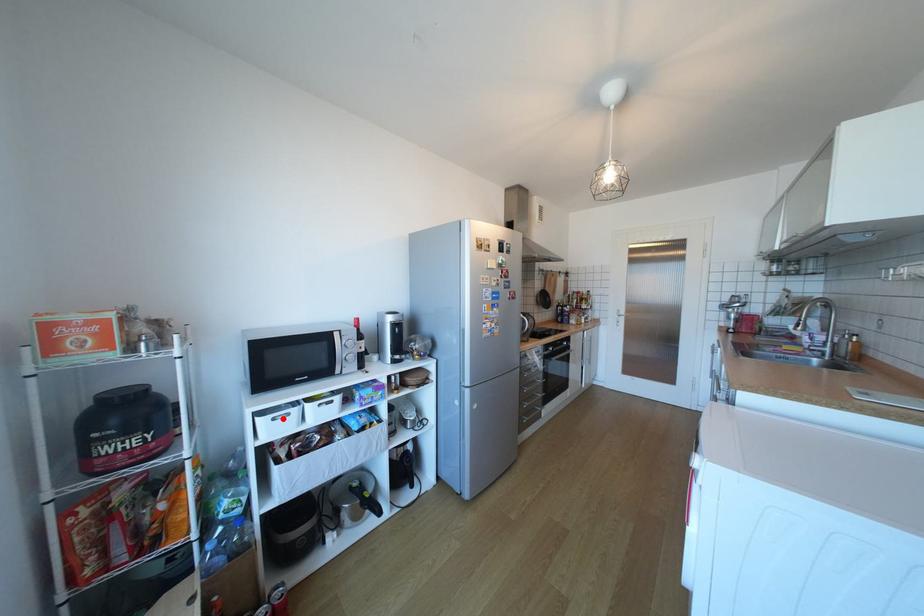
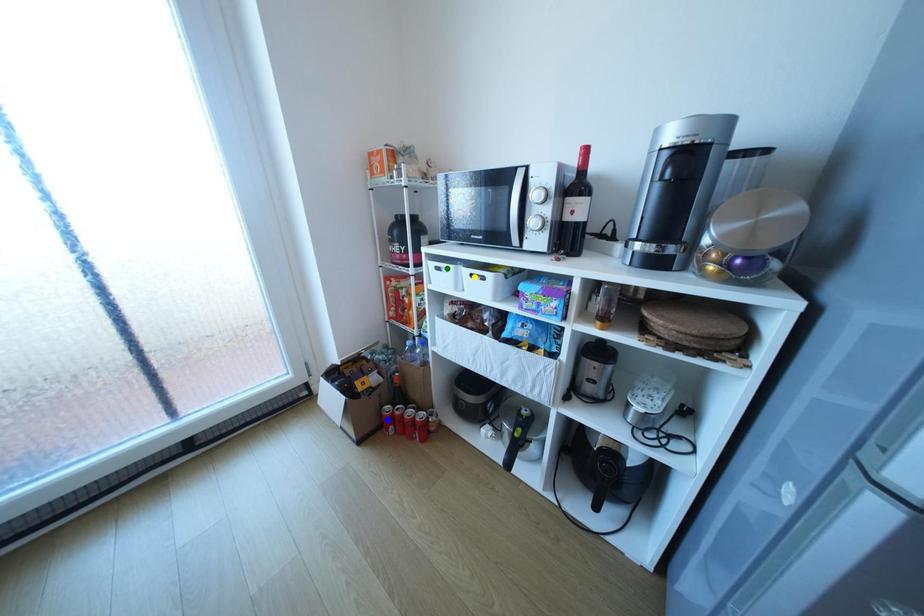
Question: I am providing you with two images of the same scene from different viewpoints. A red point is marked on the first image. You are given multiple points on the second image. Which mark in image 2 goes with the point in image 1?

Choices:
 (A) yellow point
 (B) blue point
 (C) green point

Answer: (C)